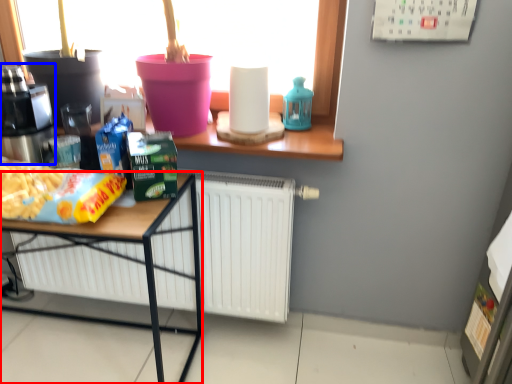
Question: Which object appears closest to the camera in this image, desk (highlighted by a red box) or coffee machine (highlighted by a blue box)?

Choices:
 (A) desk
 (B) coffee machine

Answer: (A)